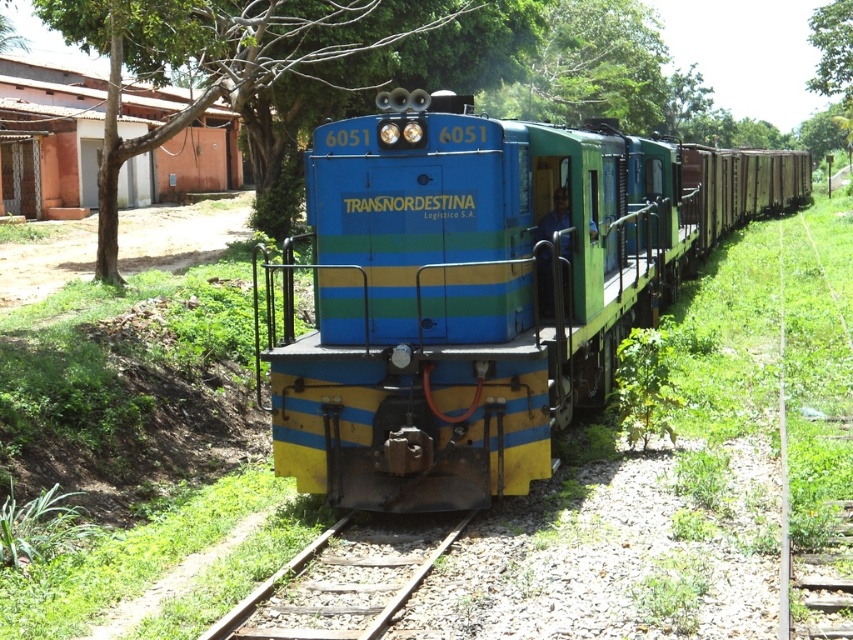
You are a photographer standing at the edge of the railway track. You want to capture a photo of the blue glossy train at center and the rusty metal train track at center. Based on their sizes in the image, which one would appear larger in the photo?

The blue glossy train at center appears larger in the photo because it is much taller than the rusty metal train track at center.

You are a photographer standing at a viewpoint overlooking the scene. You want to capture both the blue glossy train at center and the green leafy tree at center in a single shot. Which object should you position closer to the edge of the frame to ensure both are visible?

Since the blue glossy train at center is smaller than the green leafy tree at center, you should position the green leafy tree at center closer to the edge of the frame to ensure both are visible in the shot.

Consider the image. You are standing at the point with coordinates point (502, 17) and want to watch the train pass by. If you look towards point (291, 557), will the train be moving towards you or away from you?

The train is moving away from you because point (502, 17) is behind point (291, 557). Since you are at the point behind, the train would be moving in the direction away from your position.